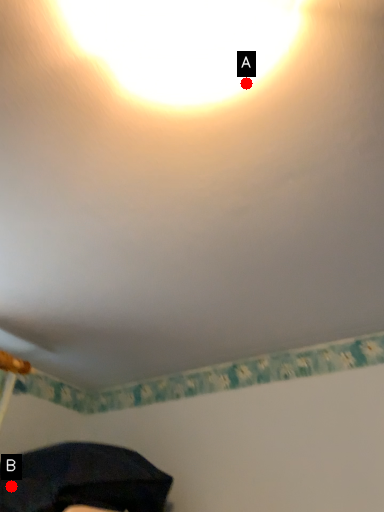
Question: Two points are circled on the image, labeled by A and B beside each circle. Which point is closer to the camera?

Choices:
 (A) A is closer
 (B) B is closer

Answer: (A)